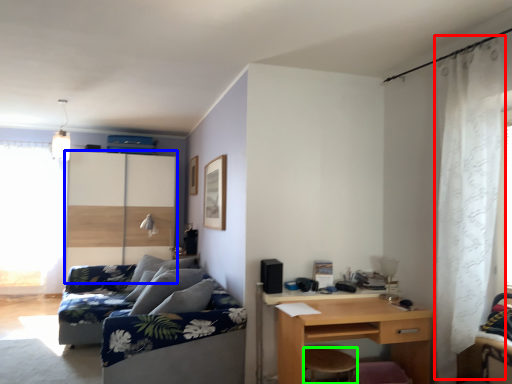
Question: Estimate the real-world distances between objects in this image. Which object is farther from curtain (highlighted by a red box), screen door (highlighted by a blue box) or stool (highlighted by a green box)?

Choices:
 (A) screen door
 (B) stool

Answer: (A)